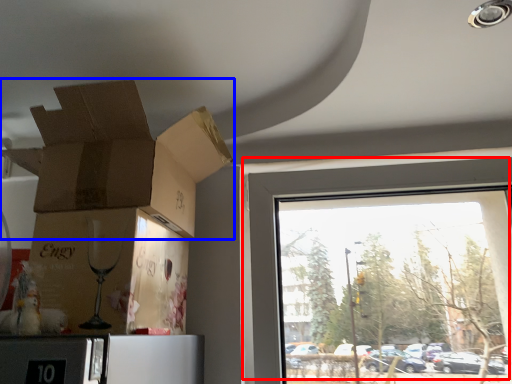
Question: Which point is further to the camera, window (highlighted by a red box) or cardboard box (highlighted by a blue box)?

Choices:
 (A) window
 (B) cardboard box

Answer: (A)